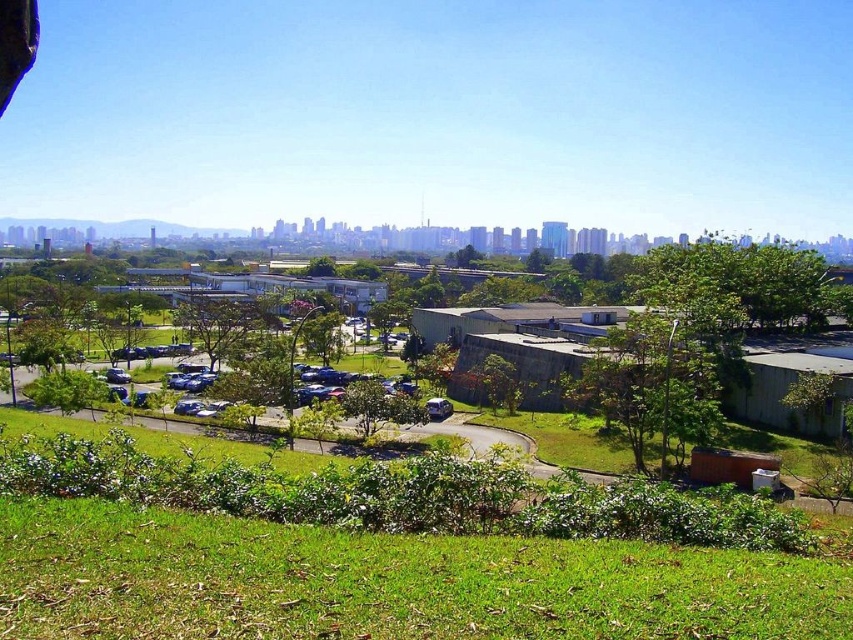
You are a drone operator who needs to fly a drone from the green grassy park at lower left to the green leafy tree at center. Considering the height difference, will the drone have to ascend or descend to reach its destination?

The green grassy park at lower left is shorter than the green leafy tree at center, so the drone will have to ascend to reach the green leafy tree at center.

You are standing at the center of the image and want to find the green grassy park at lower left. Which direction should you look to locate it?

You should look to the lower left direction to locate the green grassy park at lower left as it is positioned at point (x=384, y=552).

You are a city planner analyzing the image. You need to determine if the green grassy park at lower left can accommodate a new picnic area. The picnic area requires a space that is wider than the green leafy tree at center. Can the park accommodate this?

The green grassy park at lower left has a larger width than the green leafy tree at center, so yes, the park can accommodate the picnic area as it meets the width requirement.